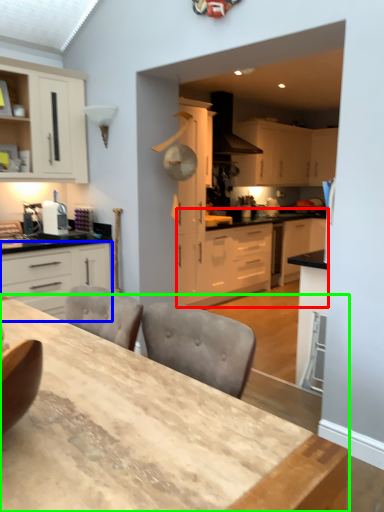
Question: Which object is positioned farthest from counter (highlighted by a red box)? Select from cabinetry (highlighted by a blue box) and table (highlighted by a green box).

Choices:
 (A) cabinetry
 (B) table

Answer: (B)